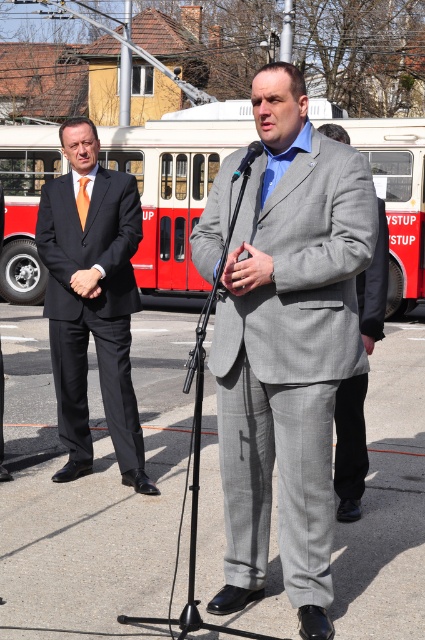
The width and height of the screenshot is (425, 640). What do you see at coordinates (289, 349) in the screenshot?
I see `gray textured suit at center` at bounding box center [289, 349].

Is gray textured suit at center wider than matte black hands at center?

Indeed, gray textured suit at center has a greater width compared to matte black hands at center.

This screenshot has width=425, height=640. I want to click on gray textured suit at center, so click(x=289, y=349).

You are a GUI agent. You are given a task and a screenshot of the screen. Output one action in this format:
    pyautogui.click(x=<x>, y=<y>)
    Task: Click on the gray textured suit at center
    
    Given the screenshot: What is the action you would take?
    pyautogui.click(x=289, y=349)

Is gray wool suit at center further to camera compared to matte black hands at center?

No.

This screenshot has width=425, height=640. What do you see at coordinates (350, 445) in the screenshot? I see `gray wool suit at center` at bounding box center [350, 445].

Image resolution: width=425 pixels, height=640 pixels. Identify the location of gray wool suit at center. (350, 445).

Between gray textured suit at center and orange silk tie at center, which one appears on the left side from the viewer's perspective?

orange silk tie at center is more to the left.

Who is more distant from viewer, (241, 209) or (85, 179)?

The point (85, 179) is more distant.

At what (x,y) coordinates should I click in order to perform the action: click on gray textured suit at center. Please return your answer as a coordinate pair (x, y). This screenshot has width=425, height=640. Looking at the image, I should click on (289, 349).